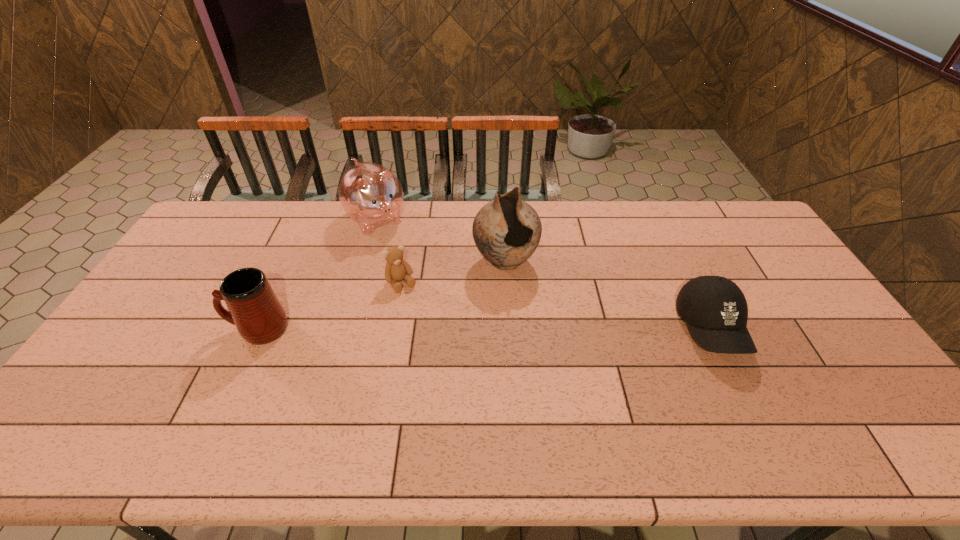
The width and height of the screenshot is (960, 540). I want to click on free space located on the side of the third shortest object with the handle, so click(130, 329).

This screenshot has width=960, height=540. What are the coordinates of `vacant space located 0.100m on the front-facing side of the baseball cap` in the screenshot? It's located at (748, 404).

Identify the location of vacant space located on the front-facing side of the teddy bear. [445, 349].

I want to click on vacant space located on the front-facing side of the teddy bear, so click(432, 330).

This screenshot has width=960, height=540. Find the location of `vacant position located on the front-facing side of the teddy bear`. vacant position located on the front-facing side of the teddy bear is located at coordinates (441, 342).

Identify the location of vacant space located on the front facing side of the second tallest object. (412, 261).

Where is `free space located on the front facing side of the second tallest object`? free space located on the front facing side of the second tallest object is located at coordinates (398, 245).

The width and height of the screenshot is (960, 540). Identify the location of blank area located 0.390m on the front facing side of the second tallest object. (448, 302).

Identify the location of free space located from the spout of the second object from right to left. (523, 299).

Locate an element on the screen. Image resolution: width=960 pixels, height=540 pixels. vacant point located from the spout of the second object from right to left is located at coordinates (551, 356).